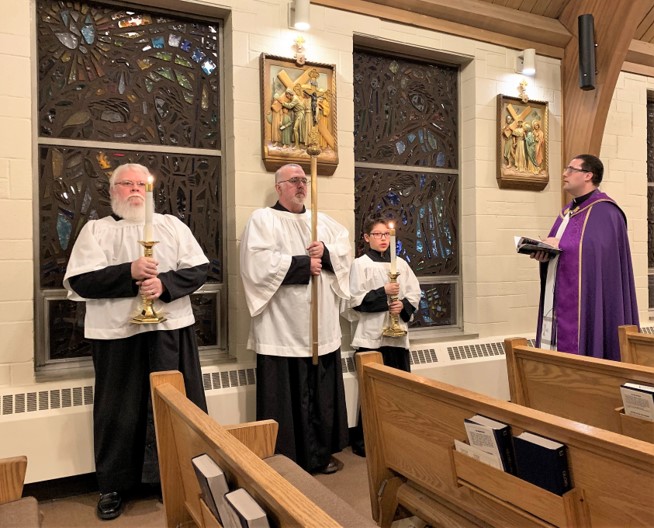
Locate an element on the screen. floor is located at coordinates (74, 513), (351, 480).